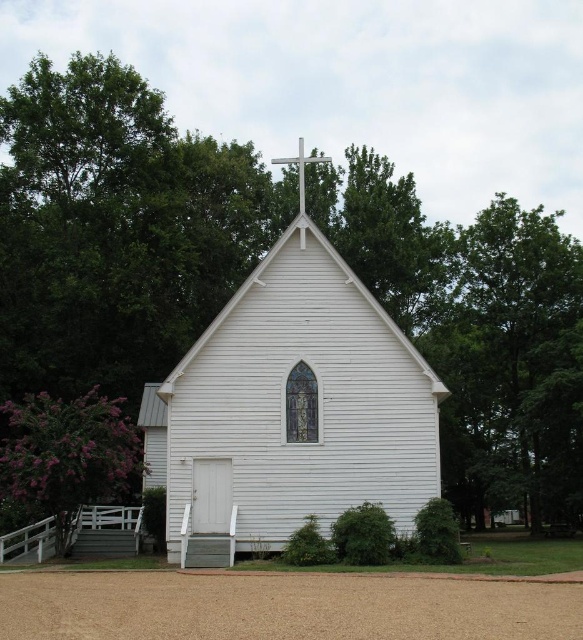
Question: Is white wood chapel at center positioned behind metallic cross at center?

Choices:
 (A) yes
 (B) no

Answer: (B)

Question: Which object is closer to the camera taking this photo?

Choices:
 (A) metallic cross at center
 (B) white wood chapel at center

Answer: (B)

Question: Is white wood chapel at center wider than metallic cross at center?

Choices:
 (A) no
 (B) yes

Answer: (B)

Question: Is white wood chapel at center positioned in front of metallic cross at center?

Choices:
 (A) yes
 (B) no

Answer: (A)

Question: Which point is farther to the camera?

Choices:
 (A) white wood chapel at center
 (B) metallic cross at center

Answer: (B)